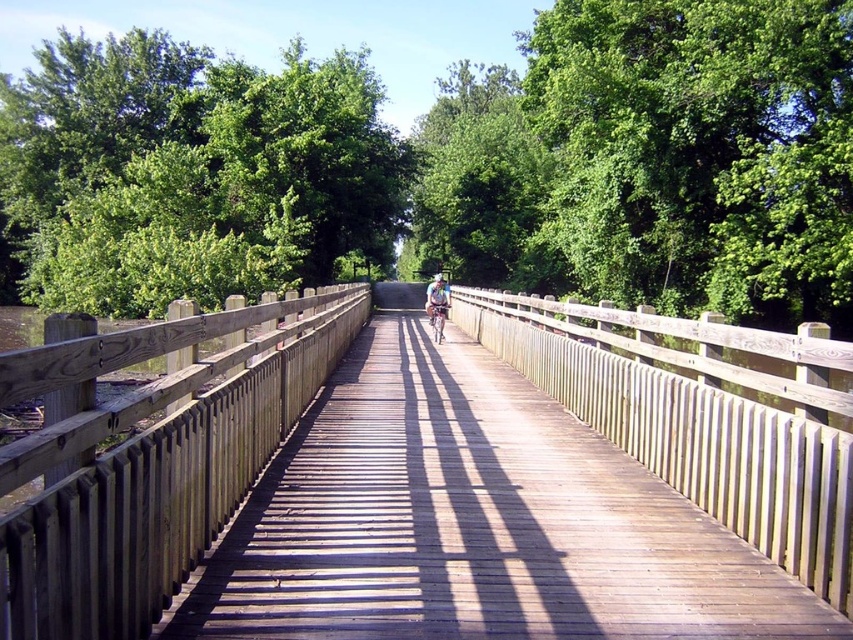
Does wooden bridge at center appear under white matte bicycle helmet at center?

Correct, wooden bridge at center is located below white matte bicycle helmet at center.

Who is more forward, (100, 556) or (439, 275)?

Point (100, 556) is more forward.

This screenshot has width=853, height=640. Find the location of `wooden bridge at center`. wooden bridge at center is located at coordinates (151, 458).

Is light blue fabric jacket at center shorter than metallic silver bicycle at center?

No.

Who is taller, light blue fabric jacket at center or metallic silver bicycle at center?

light blue fabric jacket at center is taller.

Who is more forward, (432, 296) or (430, 314)?

Point (432, 296) is in front.

This screenshot has height=640, width=853. I want to click on light blue fabric jacket at center, so click(x=437, y=305).

Based on the photo, is light blue fabric jacket at center to the right of white matte bicycle helmet at center from the viewer's perspective?

Incorrect, light blue fabric jacket at center is not on the right side of white matte bicycle helmet at center.

Describe the element at coordinates (437, 305) in the screenshot. Image resolution: width=853 pixels, height=640 pixels. I see `light blue fabric jacket at center` at that location.

Where is `light blue fabric jacket at center`? The width and height of the screenshot is (853, 640). light blue fabric jacket at center is located at coordinates (437, 305).